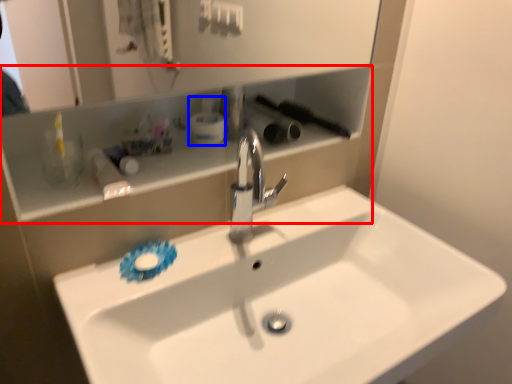
Question: Among these objects, which one is nearest to the camera, shelve (highlighted by a red box) or toiletry (highlighted by a blue box)?

Choices:
 (A) shelve
 (B) toiletry

Answer: (A)